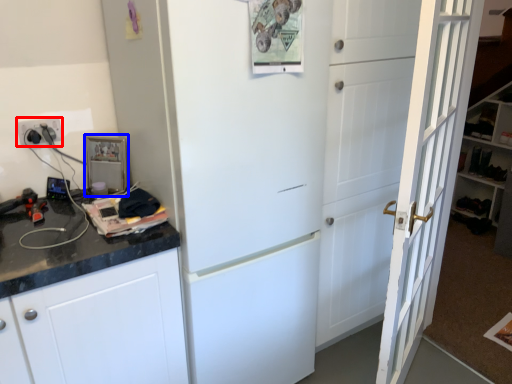
Question: Among these objects, which one is farthest to the camera, electric outlet (highlighted by a red box) or appliance (highlighted by a blue box)?

Choices:
 (A) electric outlet
 (B) appliance

Answer: (B)